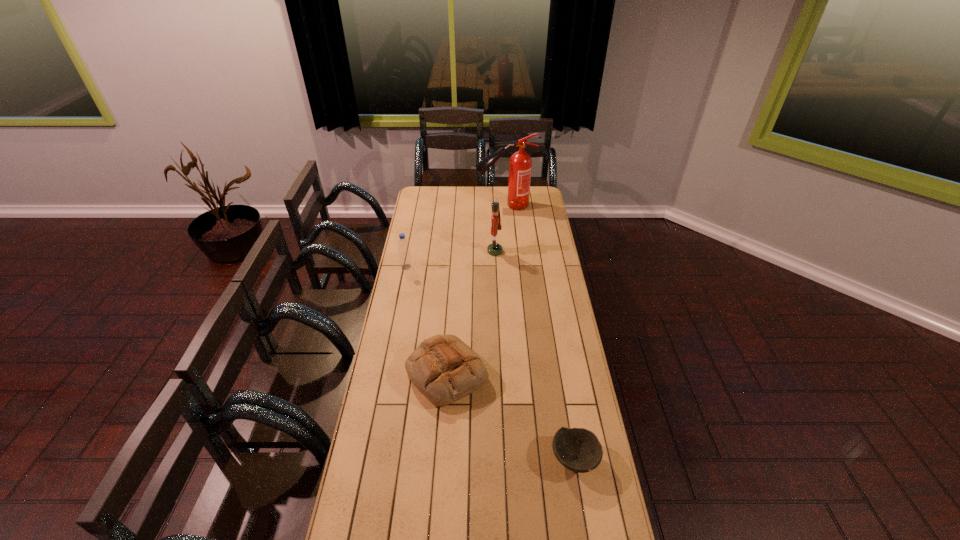
You are a GUI agent. You are given a task and a screenshot of the screen. Output one action in this format:
    pyautogui.click(x=<x>, y=<y>)
    Task: Click on the bottle that is at the left edge
    The image size is (960, 540).
    Given the screenshot: What is the action you would take?
    pyautogui.click(x=405, y=261)

Find the location of a particular element. Image resolution: width=960 pixels, height=540 pixels. bread located in the left edge section of the desktop is located at coordinates (443, 368).

This screenshot has height=540, width=960. I want to click on fire extinguisher that is at the right edge, so click(x=520, y=163).

I want to click on bowl at the right edge, so click(x=579, y=450).

You are a GUI agent. You are given a task and a screenshot of the screen. Output one action in this format:
    pyautogui.click(x=<x>, y=<y>)
    Task: Click on the object at the far right corner
    Image resolution: width=960 pixels, height=540 pixels.
    Given the screenshot: What is the action you would take?
    pyautogui.click(x=520, y=163)

You are a GUI agent. You are given a task and a screenshot of the screen. Output one action in this format:
    pyautogui.click(x=<x>, y=<y>)
    Task: Click on the vacant position at the far edge of the desktop
    The image size is (960, 540).
    Given the screenshot: What is the action you would take?
    pyautogui.click(x=468, y=201)

At what (x,y) coordinates should I click in order to perform the action: click on free region at the left edge of the desktop. Please return your answer as a coordinate pair (x, y). Looking at the image, I should click on (384, 378).

In the image, there is a desktop. In order to click on free space at the right edge in this screenshot , I will do `click(544, 340)`.

Where is `empty space that is in between the nutcracker and the third nearest object`? The image size is (960, 540). empty space that is in between the nutcracker and the third nearest object is located at coordinates (450, 259).

Where is `vacant space in between the fourth farthest object and the fire extinguisher`? vacant space in between the fourth farthest object and the fire extinguisher is located at coordinates (475, 289).